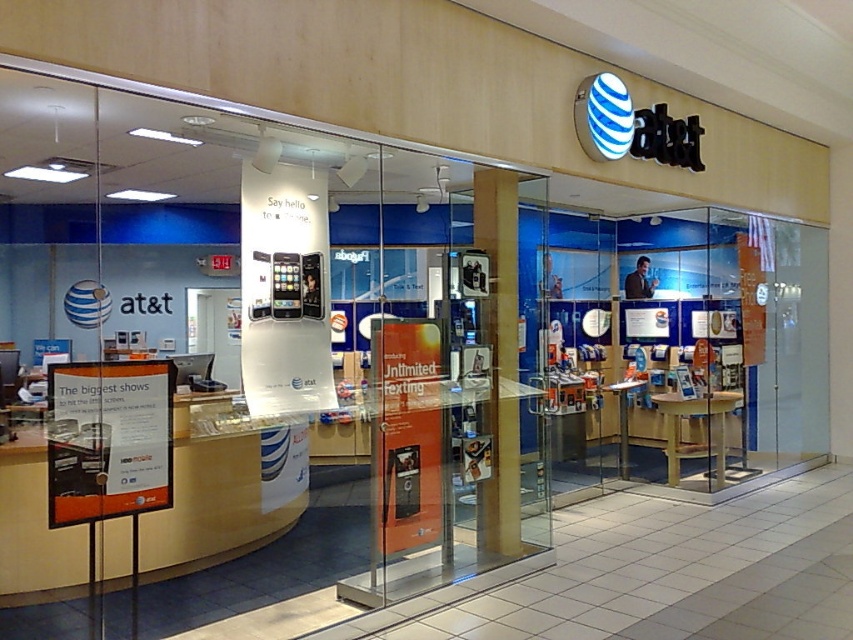
You are a customer entering the AT T store and want to see the blue glass display at center. Is the wooden pillar at center blocking your view of the display?

The wooden pillar at center is behind the blue glass display at center, so it is not blocking your view. You can see the blue glass display at center without any obstruction.